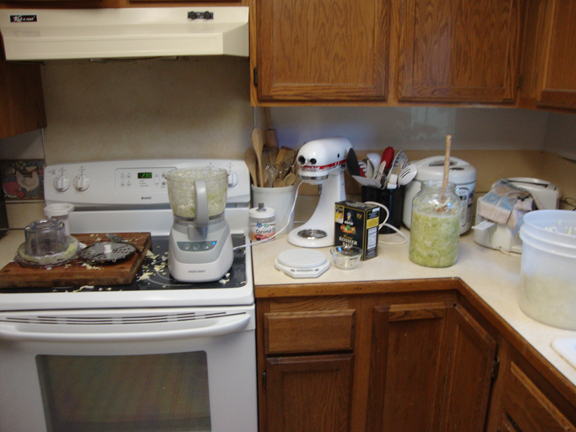
Locate an element on the screen. Image resolution: width=576 pixels, height=432 pixels. oven door is located at coordinates (216, 348).